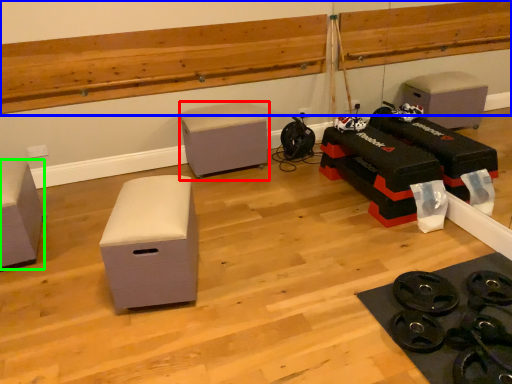
Question: Based on their relative distances, which object is farther from furniture (highlighted by a red box)? Choose from ledge (highlighted by a blue box) and furniture (highlighted by a green box).

Choices:
 (A) ledge
 (B) furniture

Answer: (B)